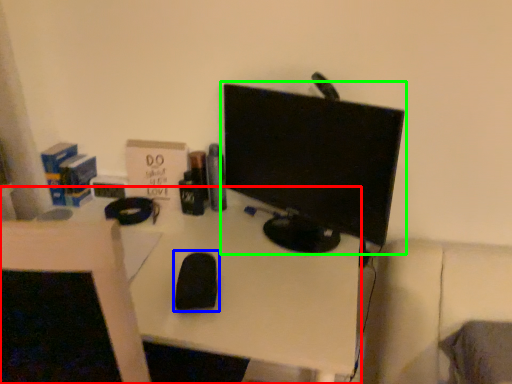
Question: Which object is positioned closest to desk (highlighted by a red box)? Select from mouse (highlighted by a blue box) and computer monitor (highlighted by a green box).

Choices:
 (A) mouse
 (B) computer monitor

Answer: (A)